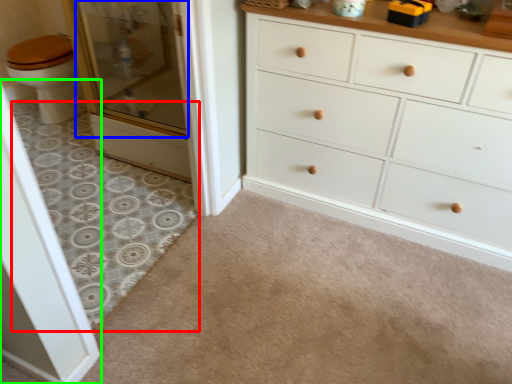
Question: Based on their relative distances, which object is farther from plain (highlighted by a red box)? Choose from screen door (highlighted by a blue box) and screen door (highlighted by a green box).

Choices:
 (A) screen door
 (B) screen door

Answer: (B)